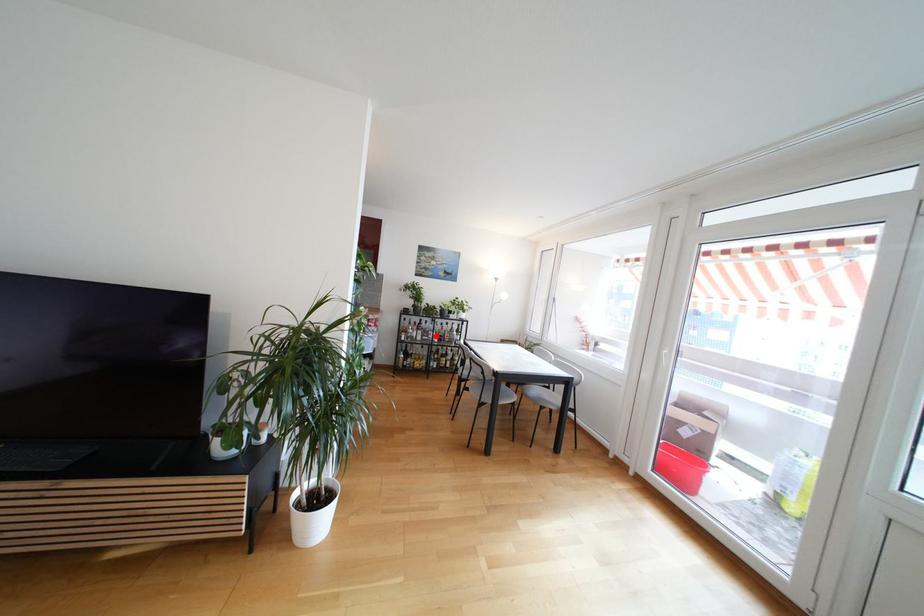
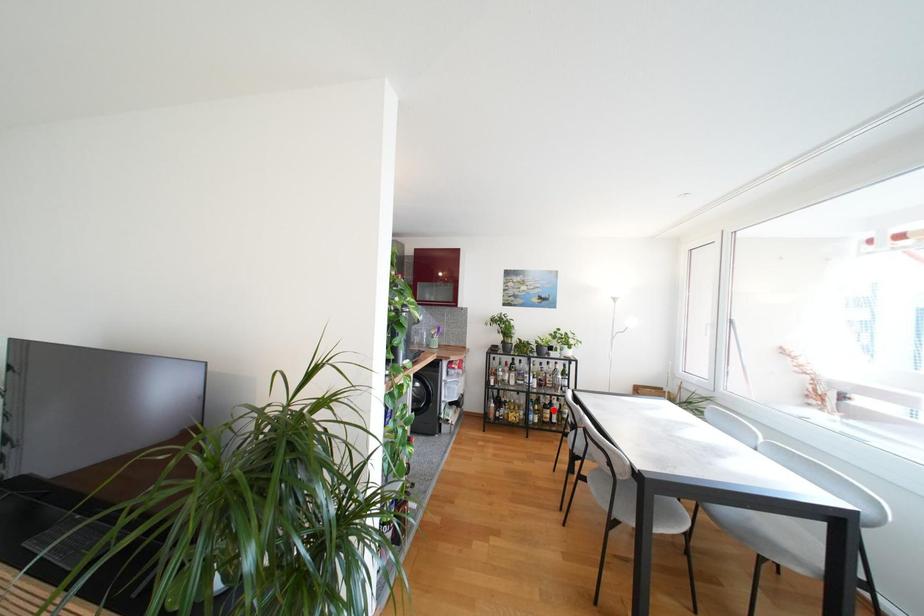
I am providing you with two images of the same scene from different viewpoints. A red point is marked on the first image and another point is marked on the second image. Does the point marked in image1 correspond to the same location as the one in image2?

No